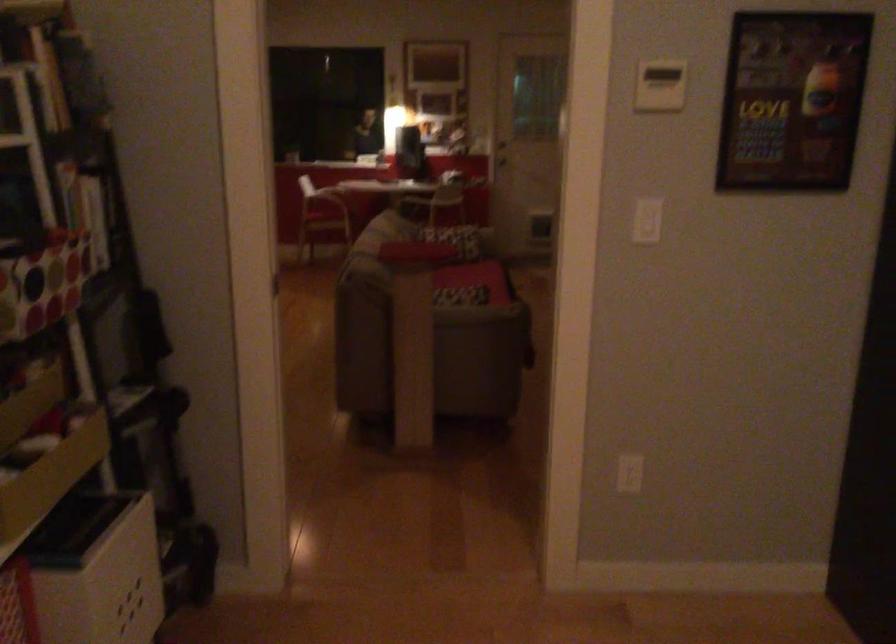
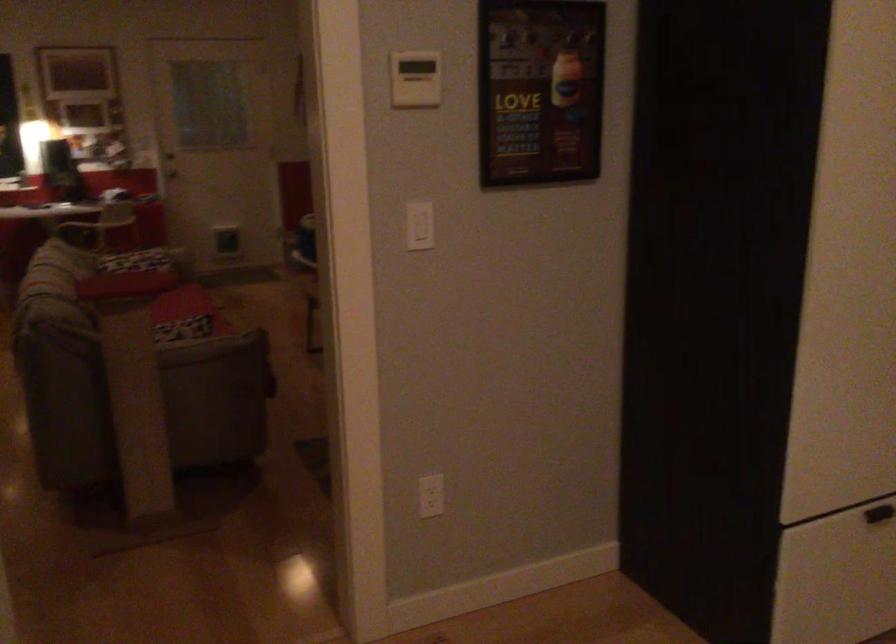
Find the pixel in the second image that matches point (631, 471) in the first image.

(431, 496)